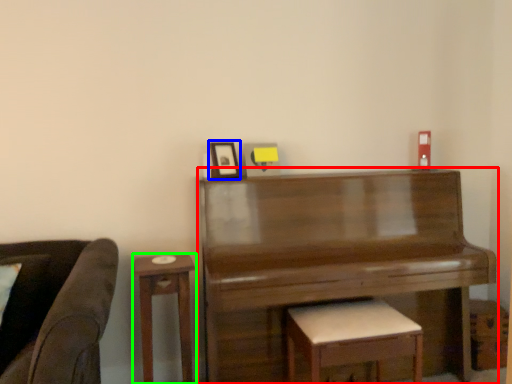
Question: Considering the real-world distances, which object is closest to piano (highlighted by a red box)? picture frame (highlighted by a blue box) or table (highlighted by a green box).

Choices:
 (A) picture frame
 (B) table

Answer: (B)